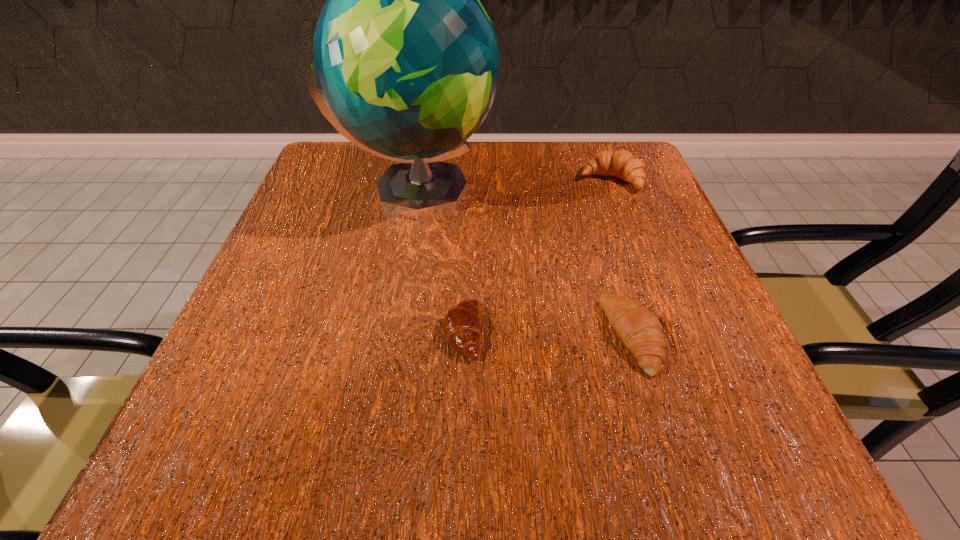
Find the location of a particular element. The width and height of the screenshot is (960, 540). free location at the far right corner of the desktop is located at coordinates (590, 189).

You are a GUI agent. You are given a task and a screenshot of the screen. Output one action in this format:
    pyautogui.click(x=<x>, y=<y>)
    Task: Click on the free space at the near right corner
    The height and width of the screenshot is (540, 960).
    Given the screenshot: What is the action you would take?
    pyautogui.click(x=770, y=460)

Find the location of a particular element. This screenshot has height=540, width=960. vacant space that is in between the third tallest object and the second tallest object is located at coordinates (623, 258).

Image resolution: width=960 pixels, height=540 pixels. What are the coordinates of `free space between the tallest object and the shortest object` in the screenshot? It's located at (439, 262).

Where is `empty space that is in between the second tallest object and the third tallest object`? empty space that is in between the second tallest object and the third tallest object is located at coordinates (623, 258).

Find the location of a particular element. blank region between the third tallest object and the tallest object is located at coordinates (525, 265).

Image resolution: width=960 pixels, height=540 pixels. What are the coordinates of `empty location between the shortest crescent roll and the tallest object` in the screenshot? It's located at (439, 262).

Where is `free space between the second tallest crescent roll and the globe`? free space between the second tallest crescent roll and the globe is located at coordinates (525, 265).

Identify the location of free space between the second shortest crescent roll and the shortest object. (549, 335).

The image size is (960, 540). I want to click on free point between the leftmost crescent roll and the tallest crescent roll, so click(537, 256).